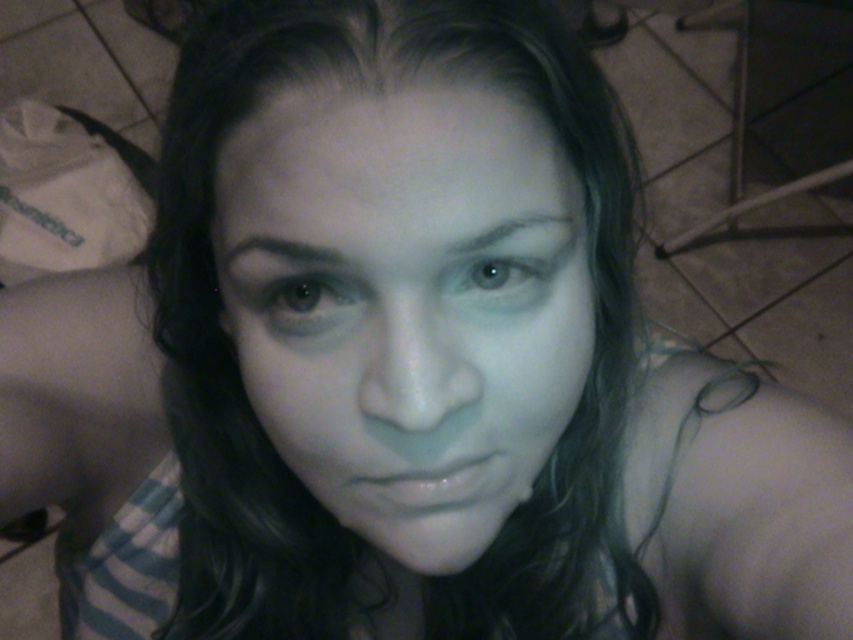
Who is lower down, dark brown hair at upper center or blue glossy eye at center?

Positioned lower is blue glossy eye at center.

Who is positioned more to the right, dark brown hair at upper center or blue glossy eye at center?

blue glossy eye at center

Which is behind, point (267, 244) or point (523, 268)?

The point (523, 268) is more distant.

The width and height of the screenshot is (853, 640). Find the location of `dark brown hair at upper center`. dark brown hair at upper center is located at coordinates (277, 252).

Between point (436, 451) and point (306, 321), which one is positioned in front?

Positioned in front is point (436, 451).

Is smooth skin face at center bigger than brown matte eye at center?

Correct, smooth skin face at center is larger in size than brown matte eye at center.

You are a GUI agent. You are given a task and a screenshot of the screen. Output one action in this format:
    pyautogui.click(x=<x>, y=<y>)
    Task: Click on the smooth skin face at center
    The height and width of the screenshot is (640, 853).
    Given the screenshot: What is the action you would take?
    pyautogui.click(x=405, y=307)

The image size is (853, 640). What are the coordinates of `smooth skin face at center` in the screenshot? It's located at (405, 307).

Which is more to the right, gray matte eyebrow at upper center or dark brown hair at upper center?

gray matte eyebrow at upper center is more to the right.

Who is taller, gray matte eyebrow at upper center or dark brown hair at upper center?

gray matte eyebrow at upper center

At what (x,y) coordinates should I click in order to perform the action: click on gray matte eyebrow at upper center. Please return your answer as a coordinate pair (x, y). Image resolution: width=853 pixels, height=640 pixels. Looking at the image, I should click on (520, 237).